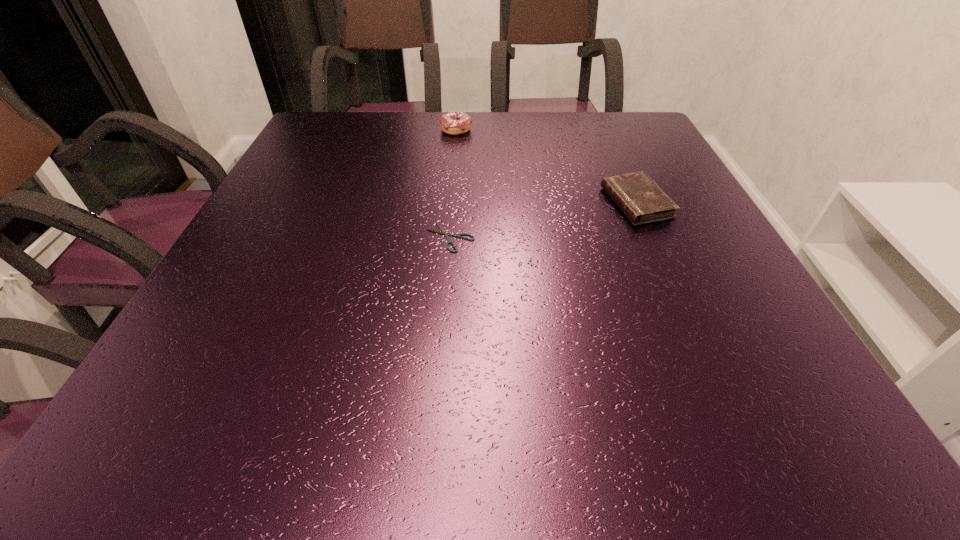
Where is `vacant space in between the second tallest object and the doughnut`? The image size is (960, 540). vacant space in between the second tallest object and the doughnut is located at coordinates (546, 166).

Where is `free spot between the shears and the doughnut`? Image resolution: width=960 pixels, height=540 pixels. free spot between the shears and the doughnut is located at coordinates (453, 184).

Find the location of a particular element. vacant space in between the shortest object and the diary is located at coordinates (543, 220).

At what (x,y) coordinates should I click in order to perform the action: click on blank region between the doughnut and the shortest object. Please return your answer as a coordinate pair (x, y). The width and height of the screenshot is (960, 540). Looking at the image, I should click on (453, 184).

Identify the location of vacant space that's between the shears and the diary. tap(543, 220).

Point out which object is positioned as the second nearest to the shortest object. Please provide its 2D coordinates. Your answer should be formatted as a tuple, i.e. [(x, y)], where the tuple contains the x and y coordinates of a point satisfying the conditions above.

[(454, 123)]

Choose which object is the nearest neighbor to the diary. Please provide its 2D coordinates. Your answer should be formatted as a tuple, i.e. [(x, y)], where the tuple contains the x and y coordinates of a point satisfying the conditions above.

[(443, 231)]

Where is `vacant space that satisfies the following two spatial constraints: 1. on the front side of the rightmost object; 2. on the left side of the doughnut`? The width and height of the screenshot is (960, 540). vacant space that satisfies the following two spatial constraints: 1. on the front side of the rightmost object; 2. on the left side of the doughnut is located at coordinates (449, 203).

This screenshot has height=540, width=960. What are the coordinates of `free space that satisfies the following two spatial constraints: 1. on the back side of the shortest object; 2. on the right side of the rightmost object` in the screenshot? It's located at (x=453, y=203).

Where is `blank area in the image that satisfies the following two spatial constraints: 1. on the front side of the second tallest object; 2. on the left side of the farthest object`? This screenshot has height=540, width=960. blank area in the image that satisfies the following two spatial constraints: 1. on the front side of the second tallest object; 2. on the left side of the farthest object is located at coordinates (449, 203).